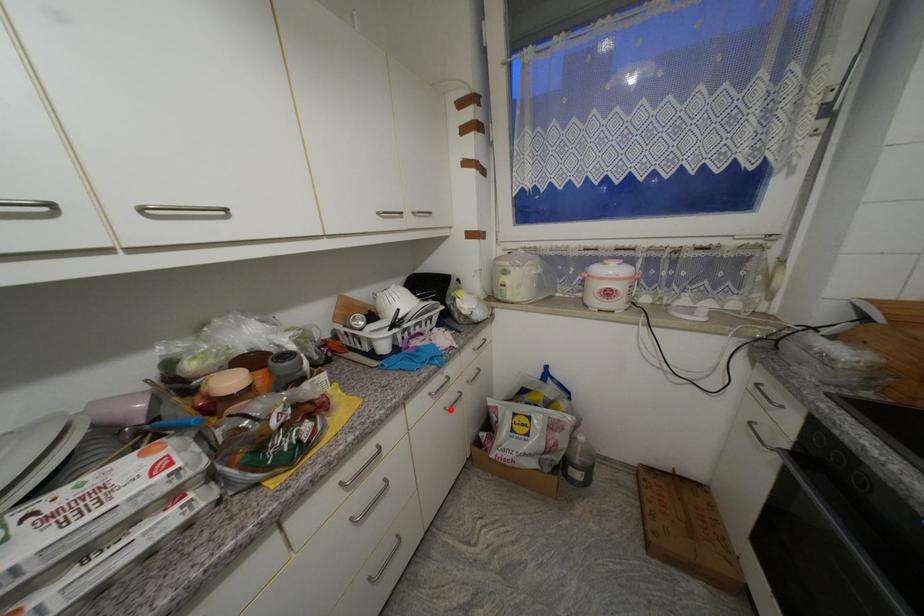
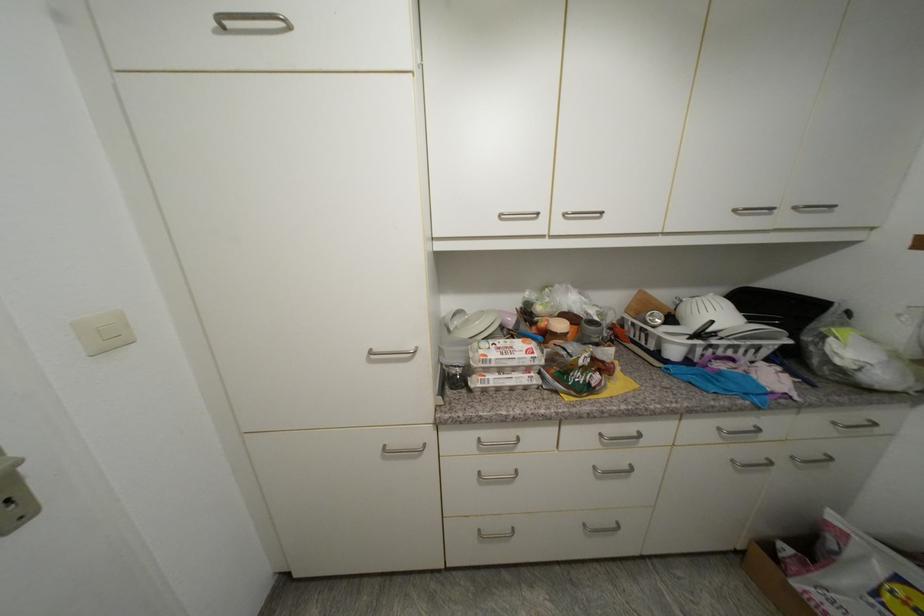
Question: I am providing you with two images of the same scene from different viewpoints. A red point is shown in image1. For the corresponding object point in image2, is it positioned nearer or farther from the camera?

Choices:
 (A) Nearer
 (B) Farther

Answer: (A)